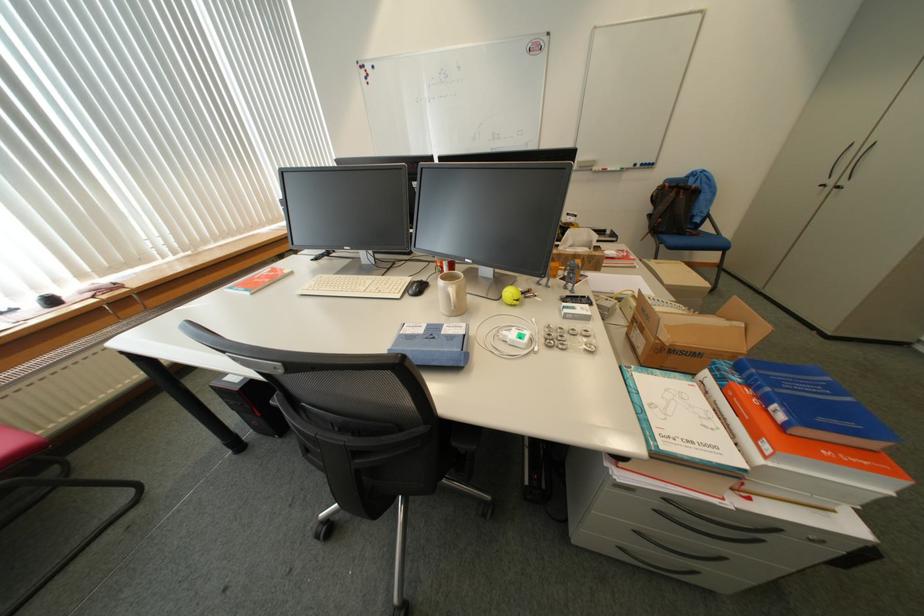
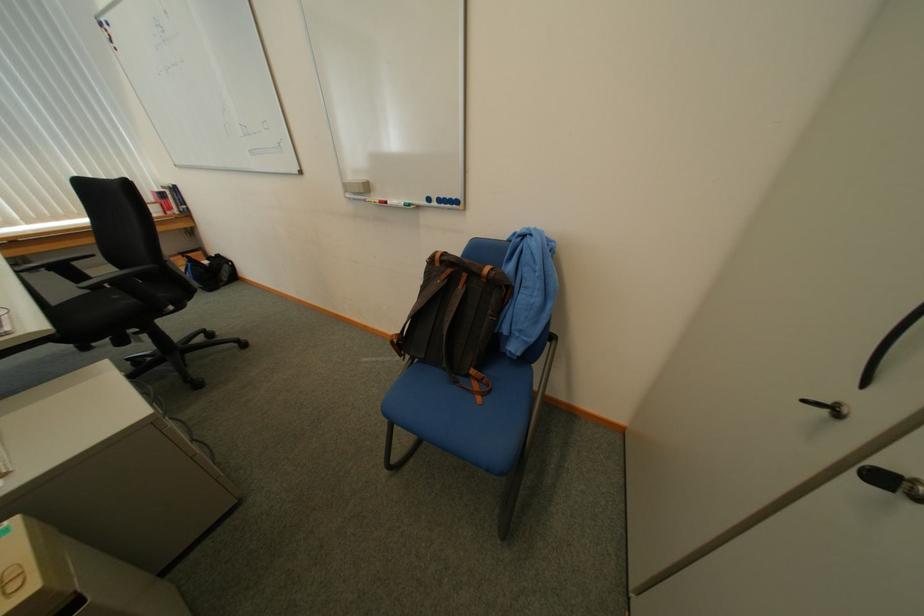
What movement of the cameraman would produce the second image?

The cameraman walked toward right, forward.